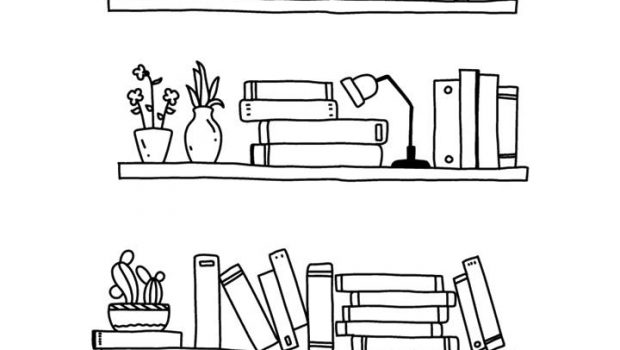
Find the location of a particular element. The height and width of the screenshot is (350, 620). books on top shelf is located at coordinates (319, 155), (317, 129), (296, 106), (290, 89), (446, 123), (463, 126), (482, 128), (508, 132).